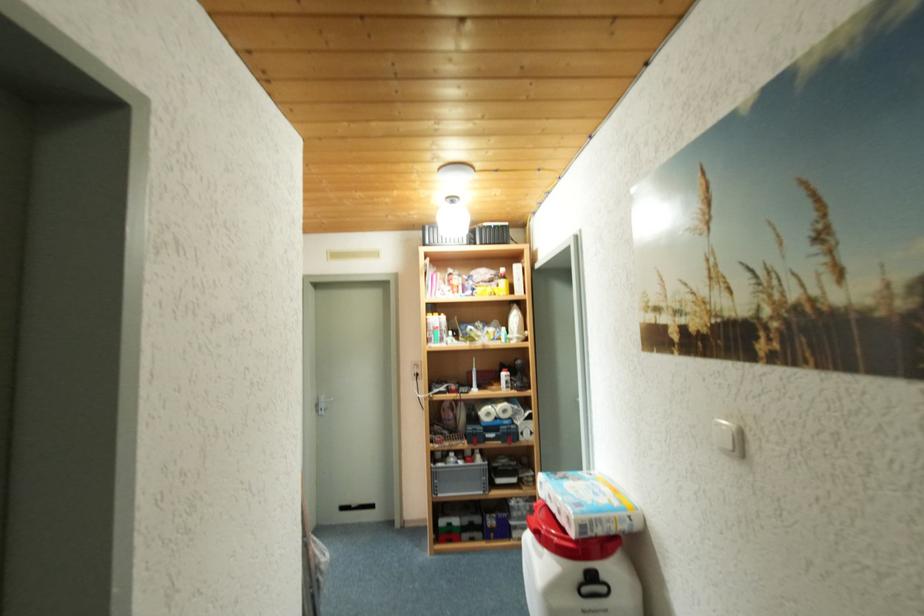
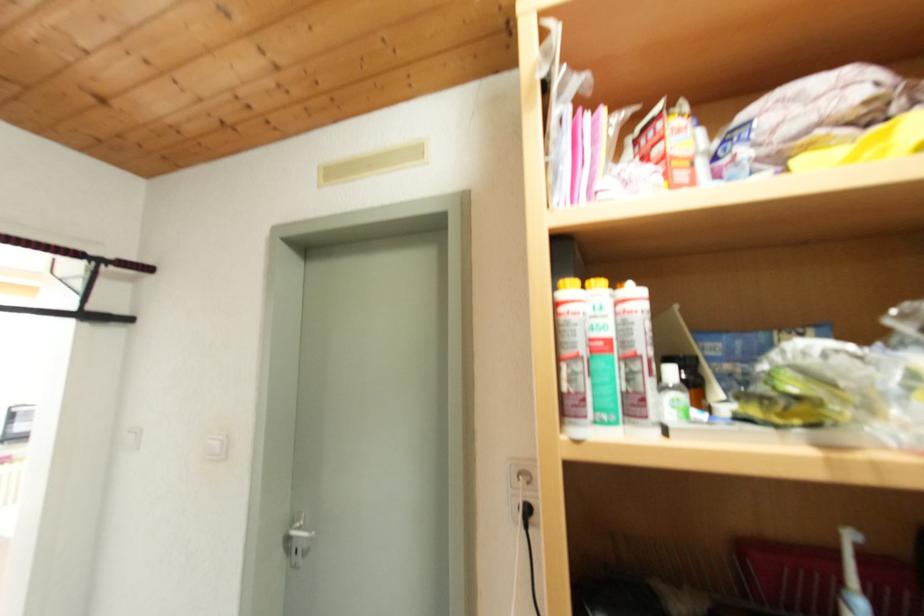
Question: What movement of the cameraman would produce the second image?

Choices:
 (A) Left
 (B) Right
 (C) Forward
 (D) Backward

Answer: (C)